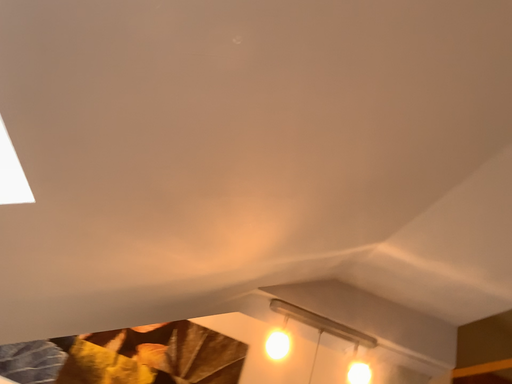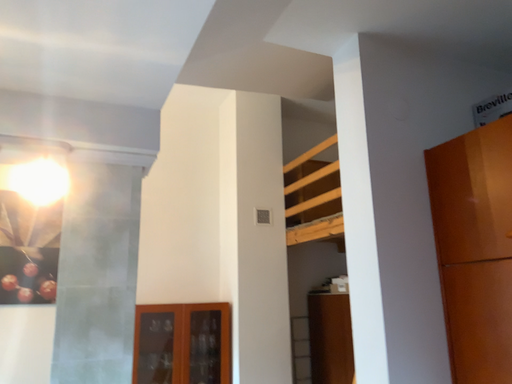
Question: How did the camera likely rotate when shooting the video?

Choices:
 (A) rotated downward
 (B) rotated upward

Answer: (A)